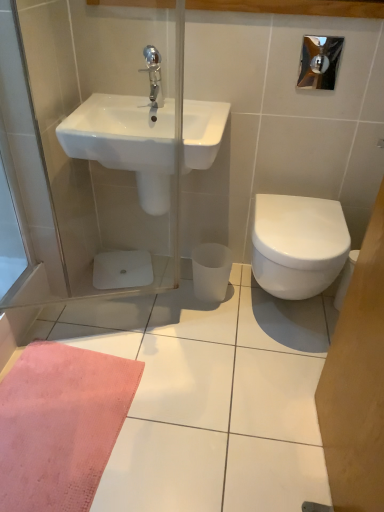
Identify the location of white glossy bidet at right. (298, 244).

What do you see at coordinates (153, 75) in the screenshot? The height and width of the screenshot is (512, 384). I see `chrome metallic faucet at upper center` at bounding box center [153, 75].

Image resolution: width=384 pixels, height=512 pixels. In order to click on white glossy bidet at right in this screenshot , I will do 298,244.

Is white glossy bidet at right to the left or to the right of chrome metallic faucet at upper center in the image?

Clearly, white glossy bidet at right is on the right of chrome metallic faucet at upper center in the image.

In terms of size, does white glossy bidet at right appear bigger or smaller than chrome metallic faucet at upper center?

Clearly, white glossy bidet at right is larger in size than chrome metallic faucet at upper center.

Would you consider white glossy bidet at right to be distant from chrome metallic faucet at upper center?

white glossy bidet at right is near chrome metallic faucet at upper center, not far away.

Which is in front, point (159, 127) or point (158, 69)?

The point (158, 69) is more forward.

Is white glossy sink at upper left touching chrome metallic faucet at upper center?

No, white glossy sink at upper left is not beside chrome metallic faucet at upper center.

Between white glossy sink at upper left and chrome metallic faucet at upper center, which one appears on the right side from the viewer's perspective?

From the viewer's perspective, chrome metallic faucet at upper center appears more on the right side.

Considering the positions of objects white glossy sink at upper left and chrome metallic faucet at upper center in the image provided, who is in front, white glossy sink at upper left or chrome metallic faucet at upper center?

white glossy sink at upper left is more forward.

In the image, there is a white glossy bidet at right. Identify the location of sink above it (from the image's perspective). (128, 136).

From their relative heights in the image, would you say white glossy bidet at right is taller or shorter than white glossy sink at upper left?

white glossy bidet at right is taller than white glossy sink at upper left.

Does white glossy bidet at right have a lesser width compared to white glossy sink at upper left?

No.

Are white glossy bidet at right and white glossy sink at upper left beside each other?

white glossy bidet at right and white glossy sink at upper left are not in contact.

From a real-world perspective, is white glossy sink at upper left under white glossy bidet at right?

Incorrect, from a real-world perspective, white glossy sink at upper left is higher than white glossy bidet at right.

From the image's perspective, which is below, white glossy sink at upper left or white glossy bidet at right?

From the image's view, white glossy bidet at right is below.

Is point (118, 121) closer to camera compared to point (301, 230)?

No, it is behind (301, 230).

Which of these two, white glossy sink at upper left or white glossy bidet at right, is smaller?

With smaller size is white glossy sink at upper left.

Considering the sizes of objects chrome metallic faucet at upper center and white glossy sink at upper left in the image provided, who is shorter, chrome metallic faucet at upper center or white glossy sink at upper left?

chrome metallic faucet at upper center.

Based on the photo, from a real-world perspective, between chrome metallic faucet at upper center and white glossy sink at upper left, who is vertically higher?

From a 3D spatial view, chrome metallic faucet at upper center is above.

Considering the positions of objects chrome metallic faucet at upper center and white glossy sink at upper left in the image provided, who is more to the right, chrome metallic faucet at upper center or white glossy sink at upper left?

From the viewer's perspective, chrome metallic faucet at upper center appears more on the right side.

Considering the positions of objects chrome metallic faucet at upper center and white glossy sink at upper left in the image provided, who is in front, chrome metallic faucet at upper center or white glossy sink at upper left?

white glossy sink at upper left is closer to the camera.

Relative to white glossy bidet at right, is chrome metallic faucet at upper center in front or behind?

chrome metallic faucet at upper center is behind white glossy bidet at right.

Considering the sizes of objects chrome metallic faucet at upper center and white glossy bidet at right in the image provided, who is shorter, chrome metallic faucet at upper center or white glossy bidet at right?

Standing shorter between the two is chrome metallic faucet at upper center.

Is point (155, 53) farther from camera compared to point (275, 240)?

No, it is in front of (275, 240).

Image resolution: width=384 pixels, height=512 pixels. In the image, there is a chrome metallic faucet at upper center. What are the coordinates of `bidet below it (from the image's perspective)` in the screenshot? It's located at (298, 244).

The width and height of the screenshot is (384, 512). I want to click on tap behind the white glossy sink at upper left, so click(153, 75).

Estimate the real-world distances between objects in this image. Which object is further from white glossy bidet at right, white glossy sink at upper left or chrome metallic faucet at upper center?

The object further to white glossy bidet at right is chrome metallic faucet at upper center.

When comparing their distances from white glossy bidet at right, does chrome metallic faucet at upper center or white glossy sink at upper left seem closer?

Among the two, white glossy sink at upper left is located nearer to white glossy bidet at right.

Looking at the image, which one is located further to chrome metallic faucet at upper center, white glossy bidet at right or white glossy sink at upper left?

The object further to chrome metallic faucet at upper center is white glossy bidet at right.

When comparing their distances from white glossy sink at upper left, does white glossy bidet at right or chrome metallic faucet at upper center seem closer?

chrome metallic faucet at upper center.

Looking at the image, which one is located further to white glossy sink at upper left, chrome metallic faucet at upper center or white glossy bidet at right?

white glossy bidet at right lies further to white glossy sink at upper left than the other object.

Which object lies further to the anchor point chrome metallic faucet at upper center, white glossy sink at upper left or white glossy bidet at right?

The object further to chrome metallic faucet at upper center is white glossy bidet at right.

Identify the location of sink that lies between chrome metallic faucet at upper center and white glossy bidet at right from top to bottom. (128, 136).